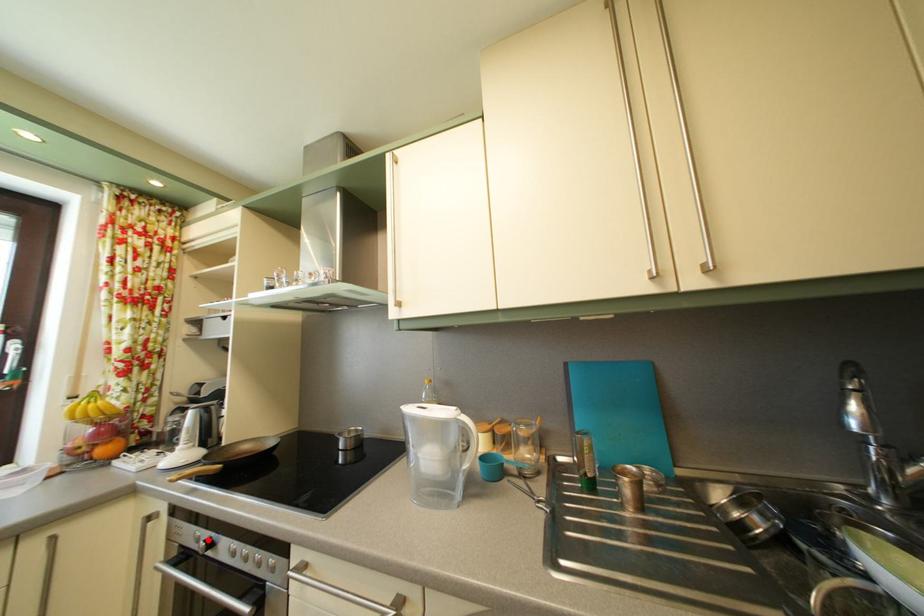
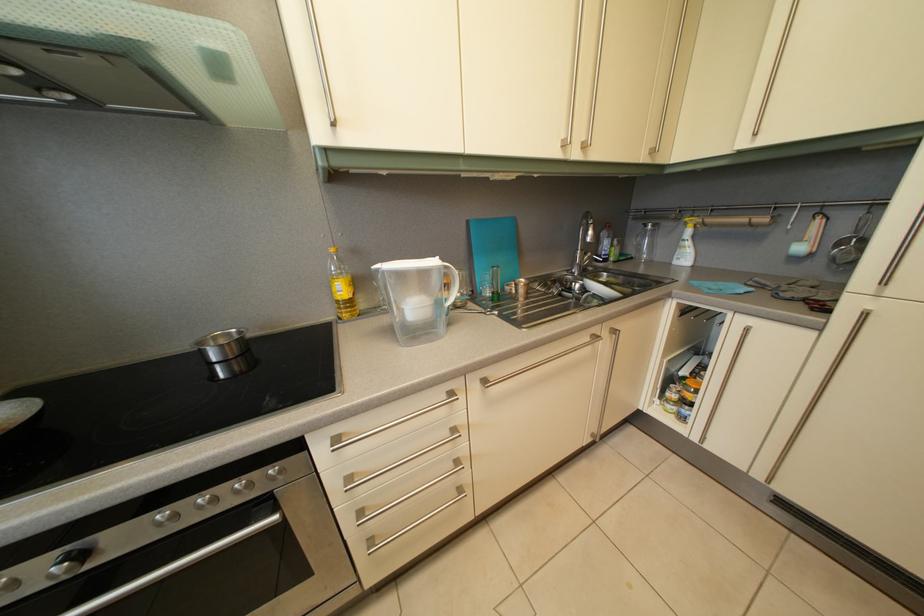
The point at the highlighted location is marked in the first image. Where is the corresponding point in the second image?

(8, 586)